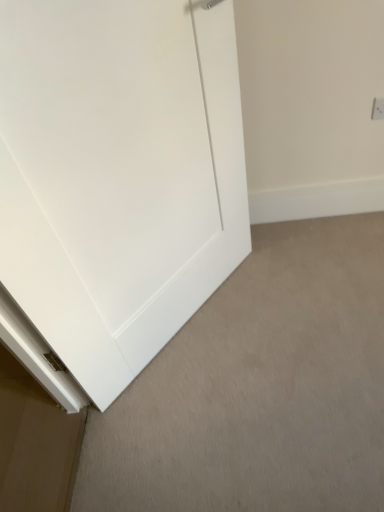
Question: Does white matte baseboard at lower left turn towards white matte door at center?

Choices:
 (A) no
 (B) yes

Answer: (B)

Question: From a real-world perspective, does white matte baseboard at lower left stand above white matte door at center?

Choices:
 (A) yes
 (B) no

Answer: (B)

Question: Is white matte baseboard at lower left bigger than white matte door at center?

Choices:
 (A) no
 (B) yes

Answer: (A)

Question: Can you confirm if white matte baseboard at lower left is thinner than white matte door at center?

Choices:
 (A) yes
 (B) no

Answer: (B)

Question: From a real-world perspective, does white matte baseboard at lower left sit lower than white matte door at center?

Choices:
 (A) yes
 (B) no

Answer: (A)

Question: Is white matte baseboard at lower left completely or partially outside of white matte door at center?

Choices:
 (A) no
 (B) yes

Answer: (B)

Question: Considering the relative sizes of white plastic electric outlet at upper right and white matte baseboard at lower left in the image provided, is white plastic electric outlet at upper right bigger than white matte baseboard at lower left?

Choices:
 (A) yes
 (B) no

Answer: (B)

Question: Is white plastic electric outlet at upper right smaller than white matte baseboard at lower left?

Choices:
 (A) yes
 (B) no

Answer: (A)

Question: Is white plastic electric outlet at upper right not within white matte baseboard at lower left?

Choices:
 (A) yes
 (B) no

Answer: (A)

Question: Is white plastic electric outlet at upper right thinner than white matte baseboard at lower left?

Choices:
 (A) no
 (B) yes

Answer: (B)

Question: Is white plastic electric outlet at upper right facing towards white matte baseboard at lower left?

Choices:
 (A) no
 (B) yes

Answer: (A)

Question: Is white plastic electric outlet at upper right facing away from white matte baseboard at lower left?

Choices:
 (A) yes
 (B) no

Answer: (B)

Question: Is the depth of white plastic electric outlet at upper right greater than that of white matte door at center?

Choices:
 (A) yes
 (B) no

Answer: (A)